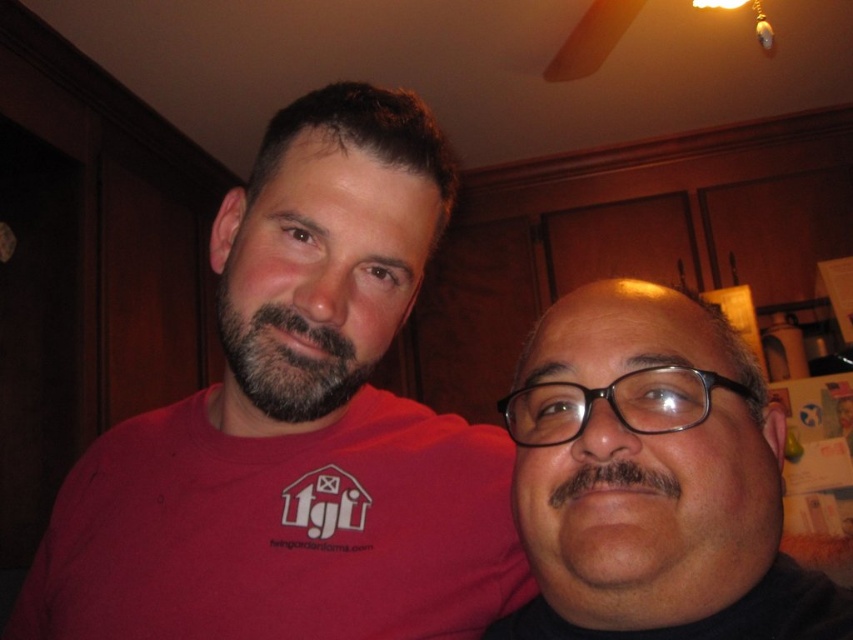
You are a photographer adjusting a camera to capture the scene. The camera has a focus setting that can only accommodate objects of a certain height. Given that the black matte glasses at center and the dark brown fuzzy beard at center are both in the frame, which object will require adjusting the focus setting due to its height?

The black matte glasses at center has a greater height compared to the dark brown fuzzy beard at center, so the focus setting must be adjusted for the black matte glasses at center to ensure proper focus.

You are standing in a kitchen and see the point at coordinates (296, 426). What object is located at that point?

The point at coordinates (296, 426) indicates the matte red t shirt at center.